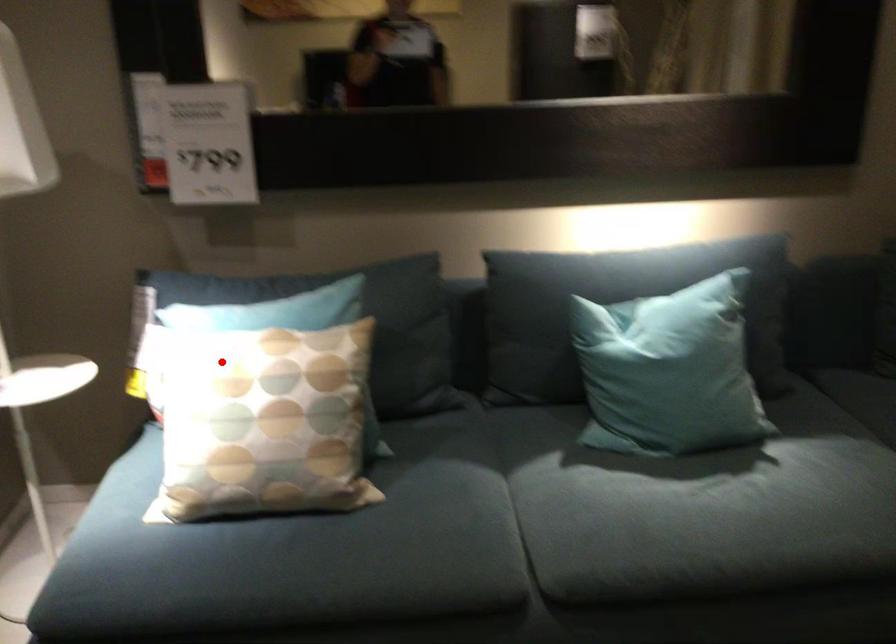
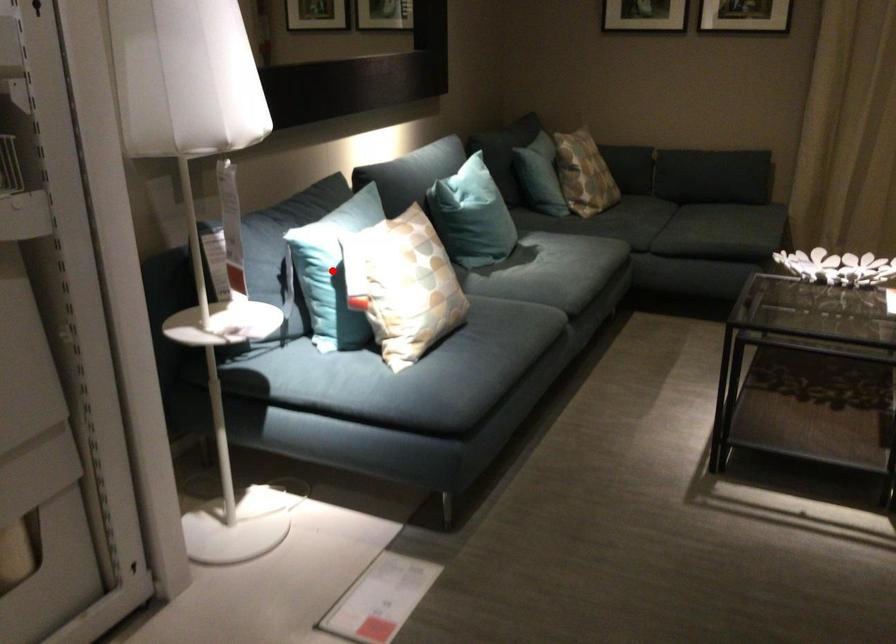
I am providing you with two images of the same scene from different viewpoints. A red point is marked on the first image and another point is marked on the second image. Is the red point in image1 aligned with the point shown in image2?

Yes